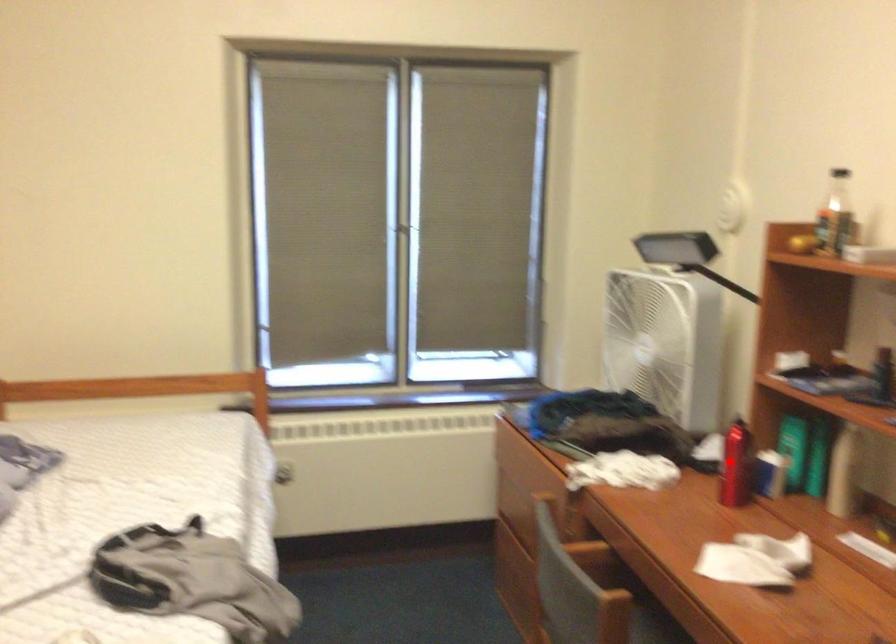
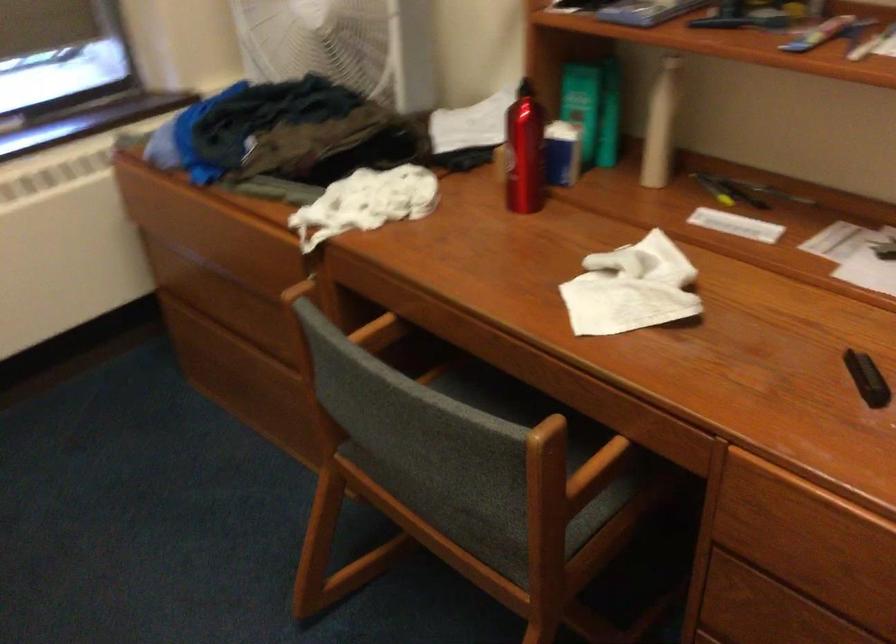
Question: I am providing you with two images of the same scene from different viewpoints. Given a red point in image1, look at the same physical point in image2. Is it:

Choices:
 (A) Closer to the viewpoint
 (B) Farther from the viewpoint

Answer: (A)